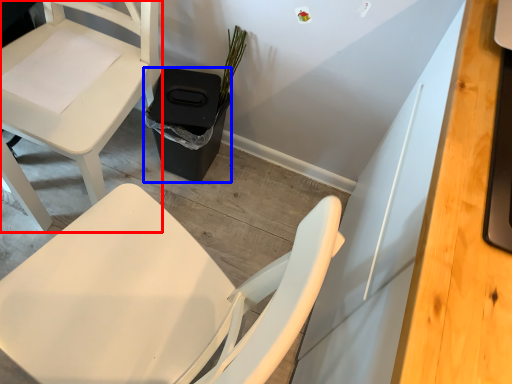
Question: Which of the following is the closest to the observer, chair (highlighted by a red box) or trash bin/can (highlighted by a blue box)?

Choices:
 (A) chair
 (B) trash bin/can

Answer: (A)